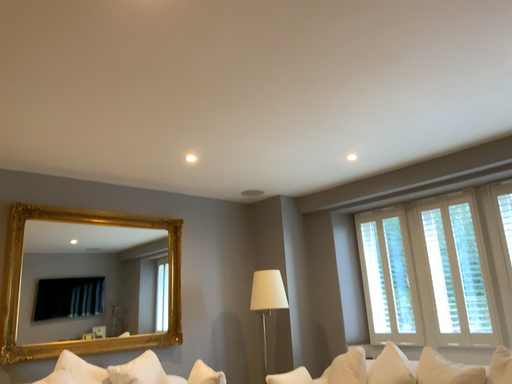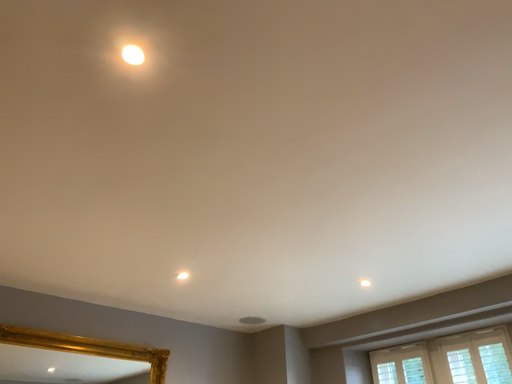
Question: Which way did the camera rotate in the video?

Choices:
 (A) rotated downward
 (B) rotated upward

Answer: (B)